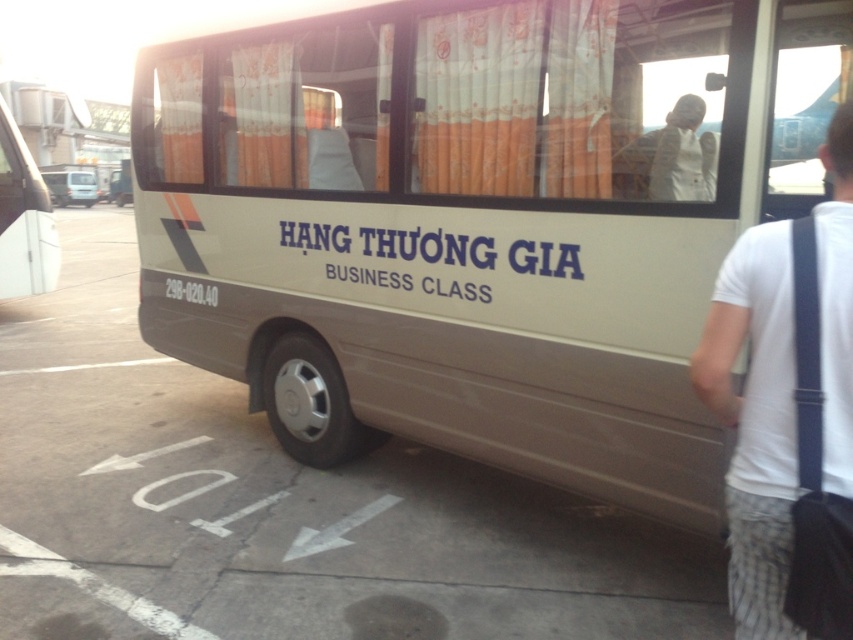
Question: Is the position of beige matte bus at center more distant than that of white fabric at upper center?

Choices:
 (A) no
 (B) yes

Answer: (A)

Question: Which point appears closest to the camera in this image?

Choices:
 (A) (242, 161)
 (B) (563, 13)

Answer: (B)

Question: Can you confirm if orange fabric curtain at upper center is bigger than beige matte bus at left?

Choices:
 (A) no
 (B) yes

Answer: (A)

Question: Estimate the real-world distances between objects in this image. Which object is closer to the beige matte bus at center?

Choices:
 (A) white fabric at upper center
 (B) beige matte bus at left
 (C) orange fabric curtain at center
 (D) white cotton shirt at right

Answer: (C)

Question: Which of the following is the farthest from the observer?

Choices:
 (A) (173, 131)
 (B) (245, 51)
 (C) (90, 205)

Answer: (C)

Question: Does orange fabric curtain at upper center appear under beige matte bus at left?

Choices:
 (A) no
 (B) yes

Answer: (B)